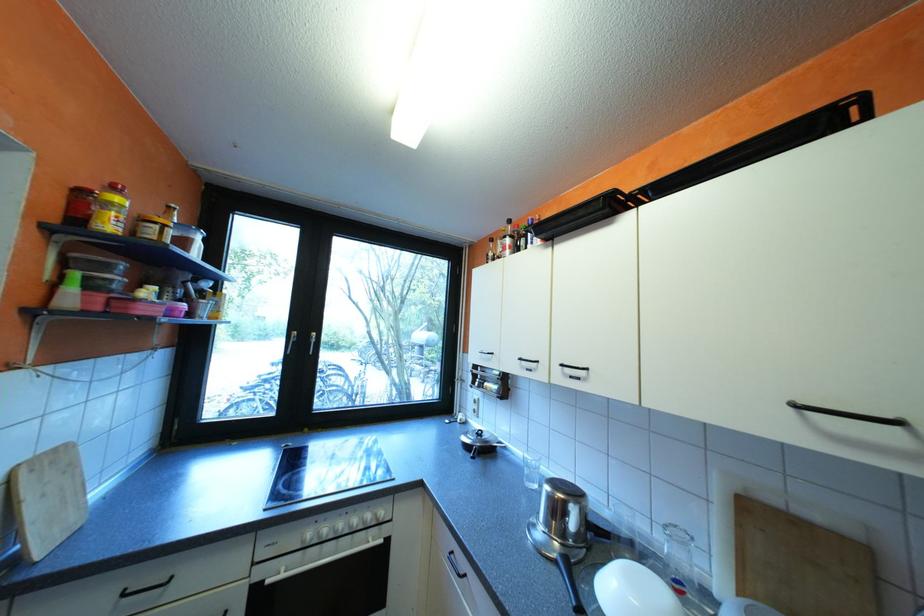
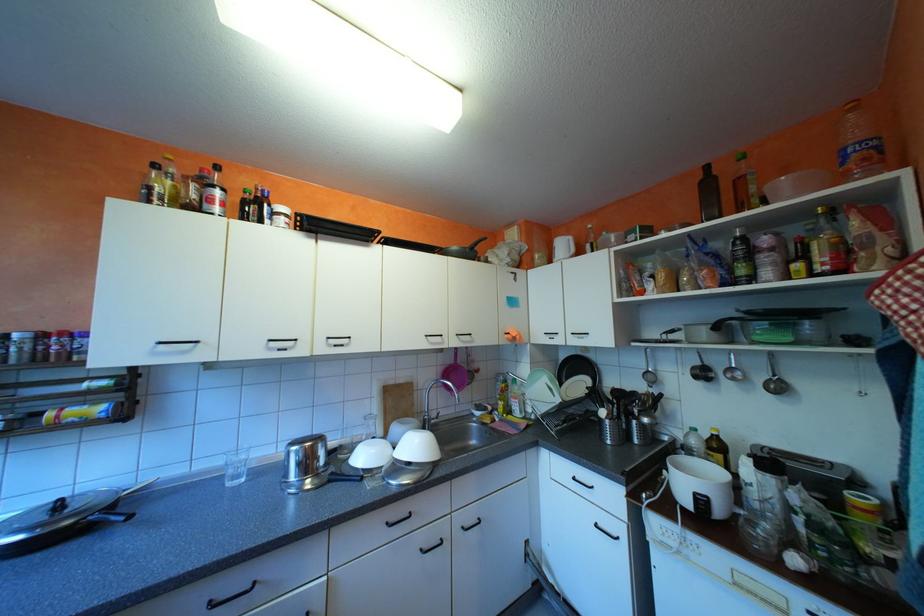
Question: Based on the continuous images, in which direction is the camera rotating? Reply with the corresponding letter.

Choices:
 (A) Left
 (B) Right
 (C) Up
 (D) Down

Answer: (B)